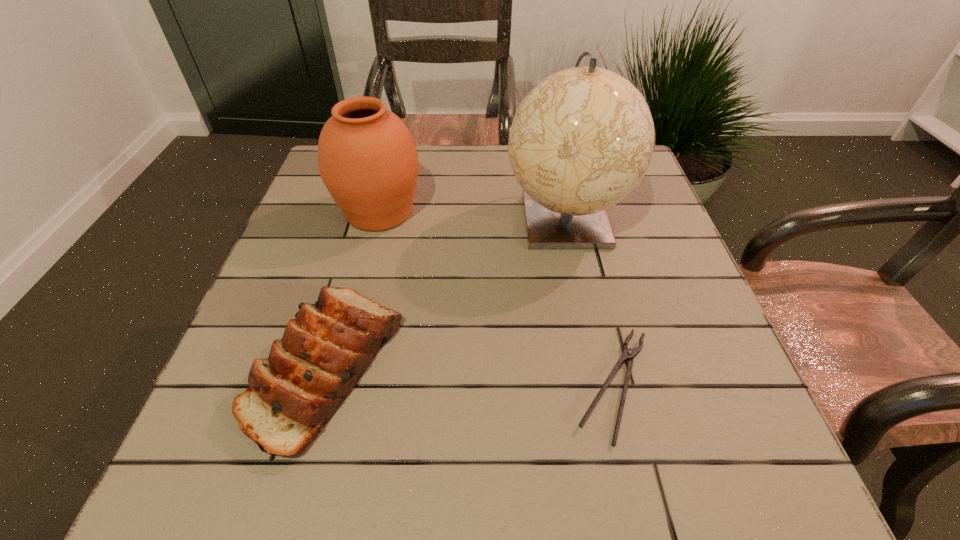
The image size is (960, 540). In order to click on bread present at the near edge in this screenshot , I will do `click(324, 351)`.

Where is `tongs positioned at the near edge`? This screenshot has width=960, height=540. tongs positioned at the near edge is located at coordinates (628, 355).

Where is `urn positioned at the left edge`? This screenshot has width=960, height=540. urn positioned at the left edge is located at coordinates (367, 159).

The width and height of the screenshot is (960, 540). I want to click on bread situated at the left edge, so click(x=324, y=351).

Find the location of `globe located in the right edge section of the desktop`. globe located in the right edge section of the desktop is located at coordinates (581, 140).

At what (x,y) coordinates should I click in order to perform the action: click on tongs present at the right edge. Please return your answer as a coordinate pair (x, y). Looking at the image, I should click on (628, 355).

Where is `object that is positioned at the far left corner`? object that is positioned at the far left corner is located at coordinates (367, 159).

Where is `object present at the near left corner`? Image resolution: width=960 pixels, height=540 pixels. object present at the near left corner is located at coordinates (324, 351).

This screenshot has width=960, height=540. What are the coordinates of `object positioned at the far right corner` in the screenshot? It's located at (581, 140).

I want to click on object that is at the near right corner, so click(628, 355).